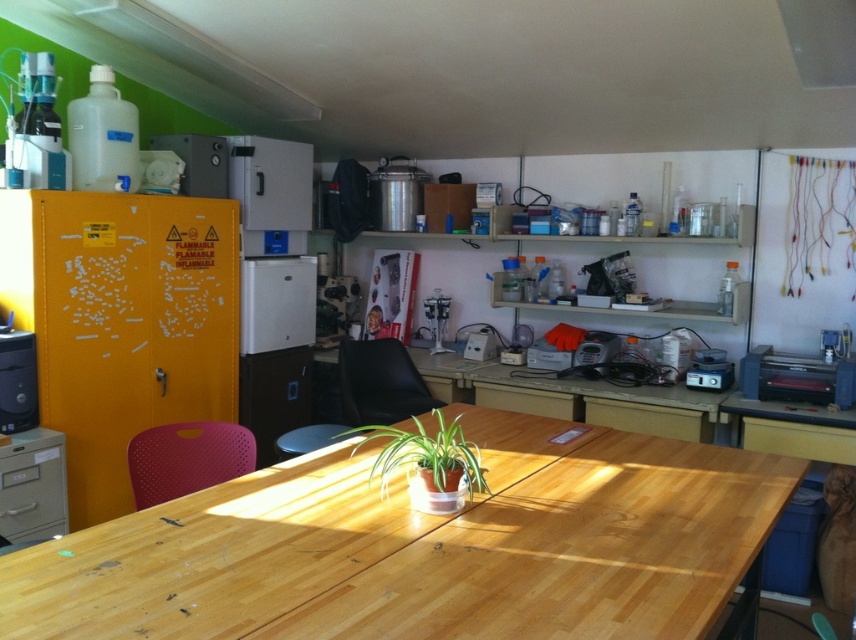
Question: Is green matte plant at center bigger than matte white appliance at upper center?

Choices:
 (A) no
 (B) yes

Answer: (B)

Question: Is natural wood table at center bigger than metallic gray electronic device at center?

Choices:
 (A) yes
 (B) no

Answer: (A)

Question: Where is natural wood table at center located in relation to matte white appliance at upper center in the image?

Choices:
 (A) left
 (B) right

Answer: (B)

Question: Which point is farther to the camera?

Choices:
 (A) purple perforated chair at lower left
 (B) white matte refrigerator at center
 (C) matte white appliance at upper center
 (D) matte black computer tower at left

Answer: (B)

Question: Among these points, which one is farthest from the camera?

Choices:
 (A) (215, 156)
 (B) (402, 346)

Answer: (B)

Question: Considering the real-world distances, which object is farthest from the natural wood table at center?

Choices:
 (A) white matte refrigerator at center
 (B) purple perforated chair at lower left
 (C) matte black computer tower at left

Answer: (A)